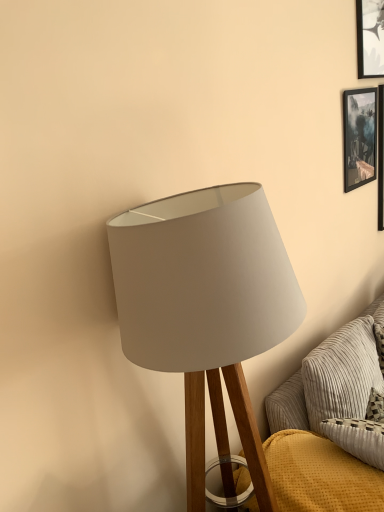
What do you see at coordinates (206, 307) in the screenshot? The height and width of the screenshot is (512, 384). I see `white fabric lampshade at center` at bounding box center [206, 307].

At what (x,y) coordinates should I click in order to perform the action: click on textured gray couch at lower right. Please return your answer as a coordinate pair (x, y). Looking at the image, I should click on 313,461.

Considering the sizes of objects white fabric lampshade at center and textured gray couch at lower right in the image provided, who is bigger, white fabric lampshade at center or textured gray couch at lower right?

Bigger between the two is white fabric lampshade at center.

Between white fabric lampshade at center and textured gray couch at lower right, which one appears on the left side from the viewer's perspective?

Positioned to the left is white fabric lampshade at center.

From the picture: Is white fabric lampshade at center aimed at textured gray couch at lower right?

No, white fabric lampshade at center is not facing towards textured gray couch at lower right.

From the image's perspective, which one is positioned higher, white fabric lampshade at center or textured gray couch at lower right?

white fabric lampshade at center.

How different are the orientations of white fabric lampshade at center and black glossy picture frame at upper right in degrees?

white fabric lampshade at center and black glossy picture frame at upper right are facing 0.162 degrees away from each other.

Is white fabric lampshade at center positioned in front of black glossy picture frame at upper right?

Yes, white fabric lampshade at center is closer to the camera.

Is white fabric lampshade at center smaller than black glossy picture frame at upper right?

Actually, white fabric lampshade at center might be larger than black glossy picture frame at upper right.

This screenshot has height=512, width=384. What are the coordinates of `lamp in front of the black glossy picture frame at upper right` in the screenshot? It's located at (206, 307).

From the image's perspective, is black glossy picture frame at upper right located above or below textured gray couch at lower right?

Based on their image positions, black glossy picture frame at upper right is located above textured gray couch at lower right.

Does black glossy picture frame at upper right have a greater height compared to textured gray couch at lower right?

In fact, black glossy picture frame at upper right may be shorter than textured gray couch at lower right.

Is textured gray couch at lower right at the back of black glossy picture frame at upper right?

black glossy picture frame at upper right is not turned away from textured gray couch at lower right.

From a real-world perspective, does black glossy picture frame at upper right sit lower than textured gray couch at lower right?

No, from a real-world perspective, black glossy picture frame at upper right is not beneath textured gray couch at lower right.

From a real-world perspective, between textured gray couch at lower right and white fabric lampshade at center, who is vertically higher?

white fabric lampshade at center, from a real-world perspective.

Can we say textured gray couch at lower right lies outside white fabric lampshade at center?

textured gray couch at lower right is positioned outside white fabric lampshade at center.

Considering the sizes of objects textured gray couch at lower right and white fabric lampshade at center in the image provided, who is smaller, textured gray couch at lower right or white fabric lampshade at center?

With smaller size is textured gray couch at lower right.

Can you see black glossy picture frame at upper right touching white fabric lampshade at center?

black glossy picture frame at upper right and white fabric lampshade at center are clearly separated.

Between point (374, 116) and point (242, 428), which one is positioned in front?

The point (242, 428) is in front.

Could you tell me if black glossy picture frame at upper right is facing white fabric lampshade at center?

No, black glossy picture frame at upper right is not facing towards white fabric lampshade at center.

Considering the sizes of objects black glossy picture frame at upper right and white fabric lampshade at center in the image provided, who is taller, black glossy picture frame at upper right or white fabric lampshade at center?

white fabric lampshade at center.

Can black glossy picture frame at upper right be found inside textured gray couch at lower right?

No, black glossy picture frame at upper right is located outside of textured gray couch at lower right.

Between textured gray couch at lower right and black glossy picture frame at upper right, which one appears on the left side from the viewer's perspective?

From the viewer's perspective, textured gray couch at lower right appears more on the left side.

Does textured gray couch at lower right have a lesser width compared to black glossy picture frame at upper right?

In fact, textured gray couch at lower right might be wider than black glossy picture frame at upper right.

Locate an element on the screen. lamp above the textured gray couch at lower right (from a real-world perspective) is located at coordinates (206, 307).

Identify the location of picture frame above the white fabric lampshade at center (from the image's perspective). The height and width of the screenshot is (512, 384). pyautogui.click(x=359, y=137).

Based on their spatial positions, is black glossy picture frame at upper right or white fabric lampshade at center further from textured gray couch at lower right?

black glossy picture frame at upper right lies further to textured gray couch at lower right than the other object.

Estimate the real-world distances between objects in this image. Which object is closer to black glossy picture frame at upper right, white fabric lampshade at center or textured gray couch at lower right?

Based on the image, textured gray couch at lower right appears to be nearer to black glossy picture frame at upper right.

Which object lies further to the anchor point white fabric lampshade at center, textured gray couch at lower right or black glossy picture frame at upper right?

black glossy picture frame at upper right.

Which object lies further to the anchor point black glossy picture frame at upper right, textured gray couch at lower right or white fabric lampshade at center?

white fabric lampshade at center is further to black glossy picture frame at upper right.

From the image, which object appears to be farther from textured gray couch at lower right, white fabric lampshade at center or black glossy picture frame at upper right?

black glossy picture frame at upper right.

Estimate the real-world distances between objects in this image. Which object is further from white fabric lampshade at center, black glossy picture frame at upper right or textured gray couch at lower right?

Based on the image, black glossy picture frame at upper right appears to be further to white fabric lampshade at center.

You are a GUI agent. You are given a task and a screenshot of the screen. Output one action in this format:
    pyautogui.click(x=<x>, y=<y>)
    Task: Click on the lamp that lies between black glossy picture frame at upper right and textured gray couch at lower right from top to bottom
    This screenshot has height=512, width=384.
    Given the screenshot: What is the action you would take?
    pyautogui.click(x=206, y=307)